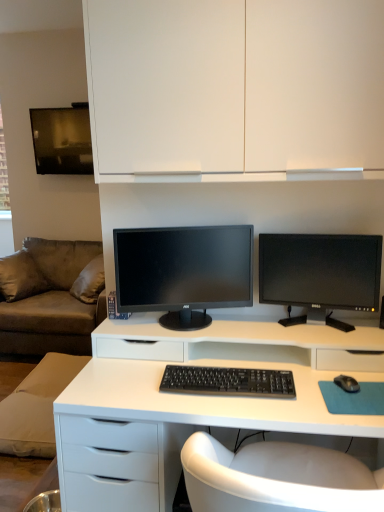
Question: From a real-world perspective, is brown fabric couch at left positioned over matte black monitor at center, arranged as the 1th computer monitor when viewed from the left, based on gravity?

Choices:
 (A) no
 (B) yes

Answer: (A)

Question: Can you confirm if brown fabric couch at left is shorter than matte black monitor at center, which appears as the second computer monitor when viewed from the right?

Choices:
 (A) yes
 (B) no

Answer: (B)

Question: Considering the relative positions of brown fabric couch at left and matte black monitor at center, which appears as the second computer monitor when viewed from the right, in the image provided, is brown fabric couch at left behind matte black monitor at center, which appears as the second computer monitor when viewed from the right,?

Choices:
 (A) yes
 (B) no

Answer: (A)

Question: Does brown fabric couch at left have a larger size compared to matte black monitor at center, arranged as the 1th computer monitor when viewed from the left?

Choices:
 (A) yes
 (B) no

Answer: (A)

Question: Does brown fabric couch at left appear on the left side of matte black monitor at center, which appears as the second computer monitor when viewed from the right?

Choices:
 (A) yes
 (B) no

Answer: (A)

Question: Is matte black monitor at center, which appears as the second computer monitor when viewed from the right, at the back of brown fabric couch at left?

Choices:
 (A) yes
 (B) no

Answer: (B)

Question: From a real-world perspective, is black matte mouse at lower right physically below white matte cabinet at upper center?

Choices:
 (A) yes
 (B) no

Answer: (A)

Question: Considering the relative positions of black matte mouse at lower right and white matte cabinet at upper center in the image provided, is black matte mouse at lower right to the left of white matte cabinet at upper center from the viewer's perspective?

Choices:
 (A) yes
 (B) no

Answer: (B)

Question: Is black matte mouse at lower right facing away from white matte cabinet at upper center?

Choices:
 (A) yes
 (B) no

Answer: (B)

Question: Is white matte cabinet at upper center a part of black matte mouse at lower right?

Choices:
 (A) no
 (B) yes

Answer: (A)

Question: Does black matte mouse at lower right have a larger size compared to white matte cabinet at upper center?

Choices:
 (A) no
 (B) yes

Answer: (A)

Question: From the image's perspective, is black matte mouse at lower right beneath white matte cabinet at upper center?

Choices:
 (A) yes
 (B) no

Answer: (A)

Question: Is matte black monitor at center, which appears as the second computer monitor when viewed from the right, to the right of black plastic keyboard at center from the viewer's perspective?

Choices:
 (A) no
 (B) yes

Answer: (A)